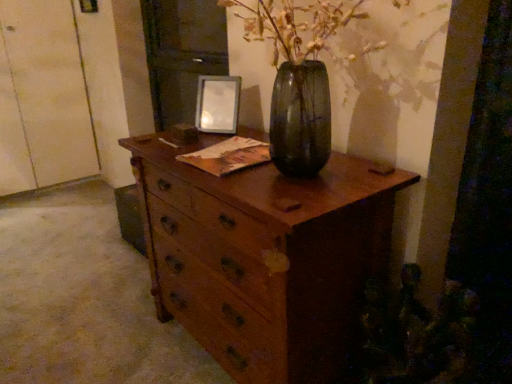
Question: Does wooden chest of drawers at center have a lesser height compared to white matte door at left?

Choices:
 (A) no
 (B) yes

Answer: (B)

Question: Does wooden chest of drawers at center come behind white matte door at left?

Choices:
 (A) no
 (B) yes

Answer: (A)

Question: Does wooden chest of drawers at center have a lesser width compared to white matte door at left?

Choices:
 (A) no
 (B) yes

Answer: (A)

Question: Are wooden chest of drawers at center and white matte door at left far apart?

Choices:
 (A) no
 (B) yes

Answer: (B)

Question: From a real-world perspective, is wooden chest of drawers at center physically above white matte door at left?

Choices:
 (A) no
 (B) yes

Answer: (A)

Question: Is point (322, 329) closer or farther from the camera than point (23, 162)?

Choices:
 (A) farther
 (B) closer

Answer: (B)

Question: From the image's perspective, is wooden chest of drawers at center positioned above or below white matte door at left?

Choices:
 (A) below
 (B) above

Answer: (A)

Question: Considering their positions, is wooden chest of drawers at center located in front of or behind white matte door at left?

Choices:
 (A) front
 (B) behind

Answer: (A)

Question: Considering the positions of wooden chest of drawers at center and white matte door at left in the image, is wooden chest of drawers at center bigger or smaller than white matte door at left?

Choices:
 (A) small
 (B) big

Answer: (A)

Question: From the image's perspective, relative to metallic silver picture frame at upper center, is white matte door at left above or below?

Choices:
 (A) below
 (B) above

Answer: (B)

Question: Is white matte door at left inside the boundaries of metallic silver picture frame at upper center, or outside?

Choices:
 (A) outside
 (B) inside

Answer: (A)

Question: Does point (58, 135) appear closer or farther from the camera than point (224, 102)?

Choices:
 (A) farther
 (B) closer

Answer: (A)

Question: Looking at the image, does white matte door at left seem bigger or smaller compared to metallic silver picture frame at upper center?

Choices:
 (A) small
 (B) big

Answer: (B)

Question: Is white matte door at left in front of or behind wooden chest of drawers at center in the image?

Choices:
 (A) front
 (B) behind

Answer: (B)

Question: Considering the positions of white matte door at left and wooden chest of drawers at center in the image, is white matte door at left bigger or smaller than wooden chest of drawers at center?

Choices:
 (A) small
 (B) big

Answer: (B)